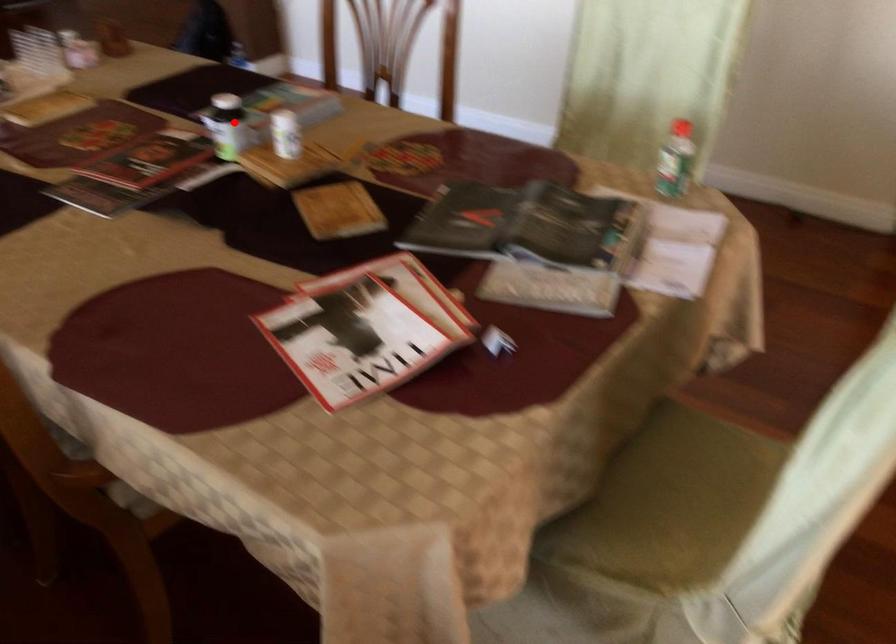
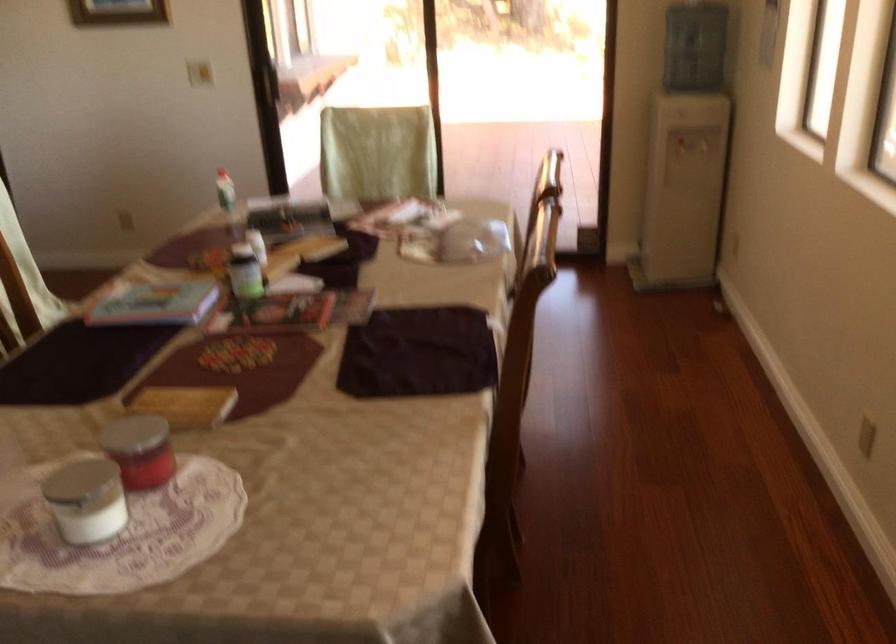
Locate, in the second image, the point that corresponds to the highlighted location in the first image.

(245, 272)